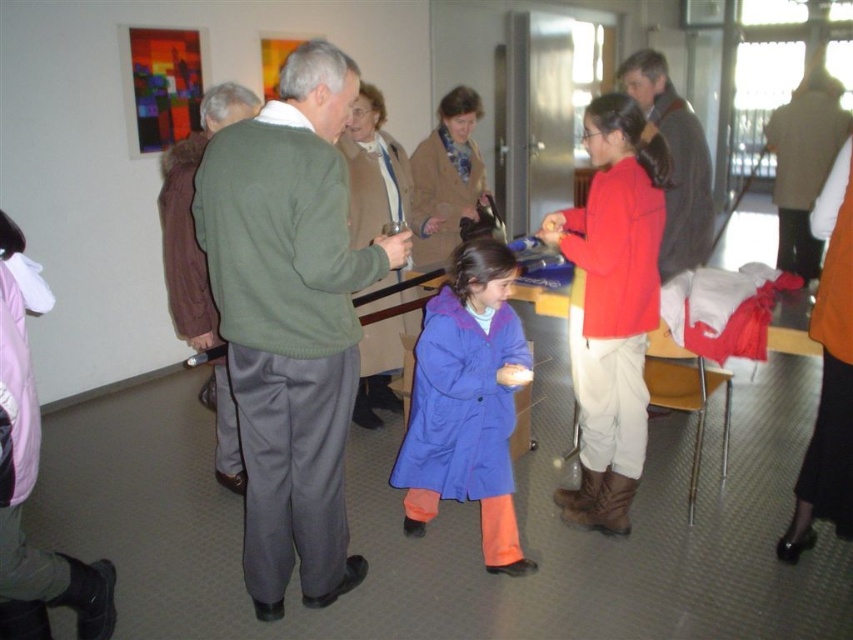
Is matte blue coat at center below green fabric jacket at center?

Indeed, matte blue coat at center is positioned under green fabric jacket at center.

Does matte blue coat at center have a smaller size compared to green fabric jacket at center?

Correct, matte blue coat at center occupies less space than green fabric jacket at center.

Does point (422, 497) come in front of point (216, 108)?

That is False.

Image resolution: width=853 pixels, height=640 pixels. In order to click on matte blue coat at center in this screenshot , I will do `click(467, 403)`.

Between green sweater at center and matte red jacket at center, which one has less height?

matte red jacket at center

Is green sweater at center closer to the viewer compared to matte red jacket at center?

Yes.

You are a GUI agent. You are given a task and a screenshot of the screen. Output one action in this format:
    pyautogui.click(x=<x>, y=<y>)
    Task: Click on the green sweater at center
    The image size is (853, 640).
    Given the screenshot: What is the action you would take?
    pyautogui.click(x=291, y=320)

Locate an element on the screen. green sweater at center is located at coordinates (291, 320).

Can you confirm if green sweater at center is bigger than matte blue coat at center?

Indeed, green sweater at center has a larger size compared to matte blue coat at center.

At what (x,y) coordinates should I click in order to perform the action: click on green sweater at center. Please return your answer as a coordinate pair (x, y). The height and width of the screenshot is (640, 853). Looking at the image, I should click on (291, 320).

Image resolution: width=853 pixels, height=640 pixels. I want to click on green sweater at center, so click(291, 320).

Where is `green sweater at center`? green sweater at center is located at coordinates (291, 320).